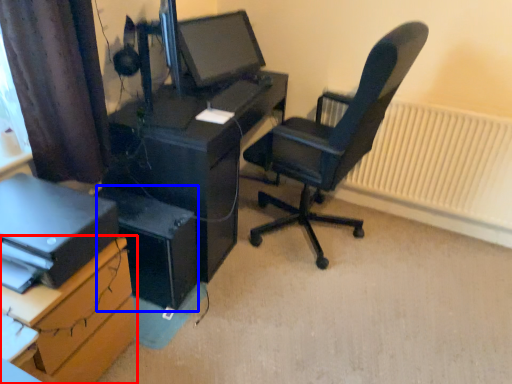
Question: Among these objects, which one is farthest to the camera, desk (highlighted by a red box) or computer tower (highlighted by a blue box)?

Choices:
 (A) desk
 (B) computer tower

Answer: (B)